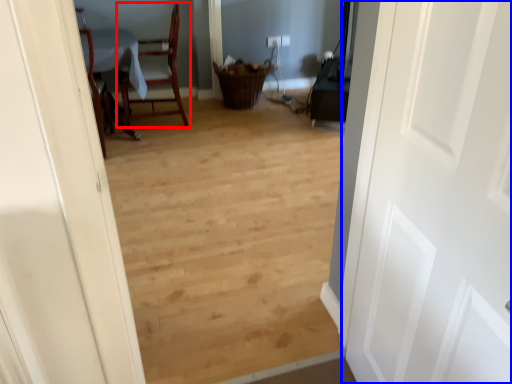
Question: Which object is further to the camera taking this photo, chair (highlighted by a red box) or door (highlighted by a blue box)?

Choices:
 (A) chair
 (B) door

Answer: (A)